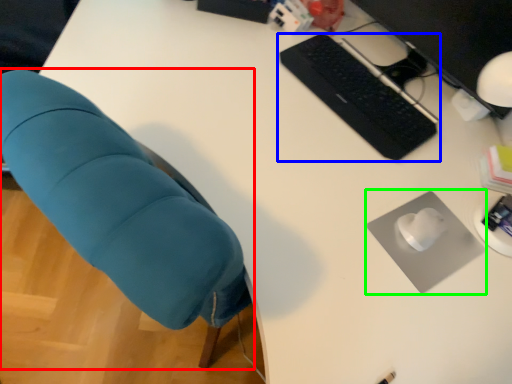
Question: Which object is positioned closest to chair (highlighted by a red box)? Select from computer keyboard (highlighted by a blue box) and mousepad (highlighted by a green box).

Choices:
 (A) computer keyboard
 (B) mousepad

Answer: (B)